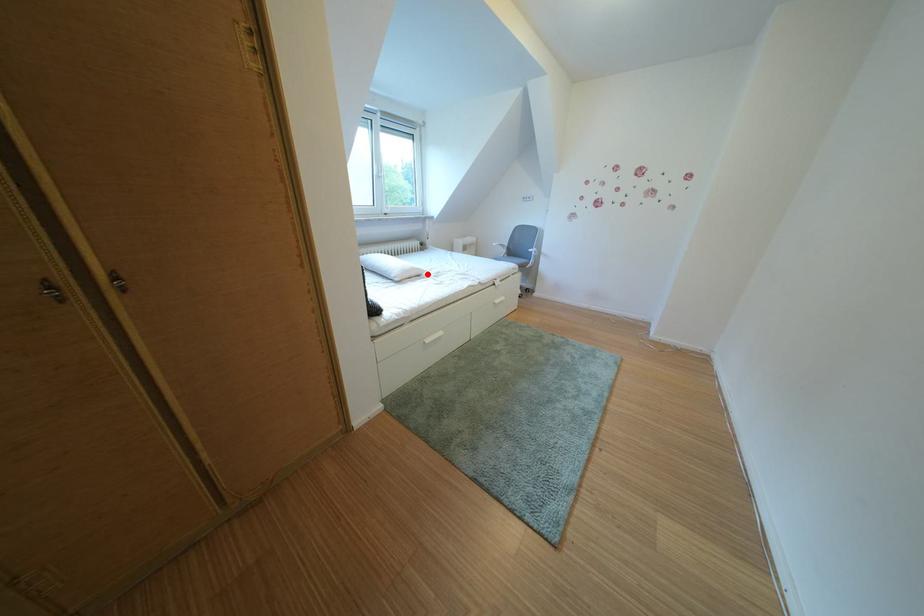
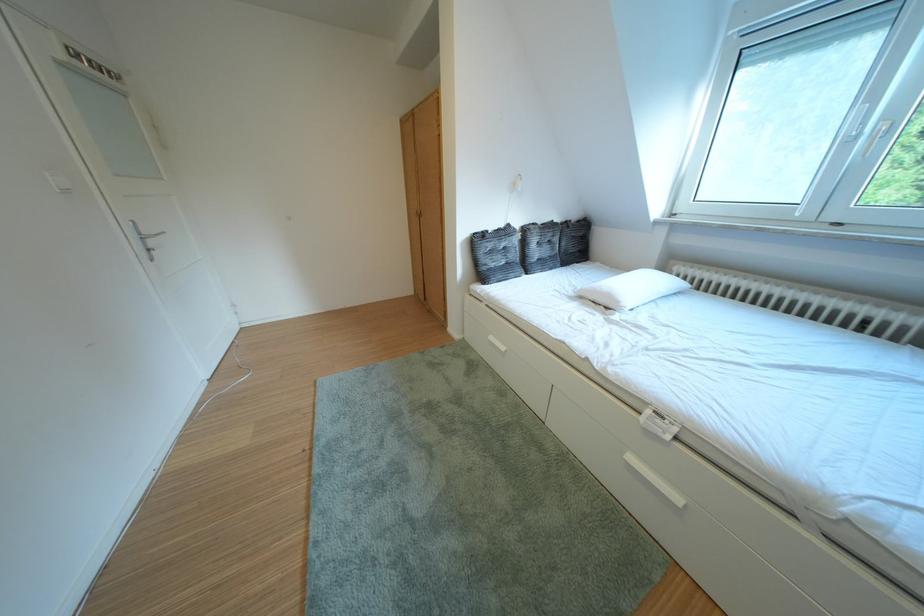
In the second image, find the point that corresponds to the highlighted location in the first image.

(623, 301)